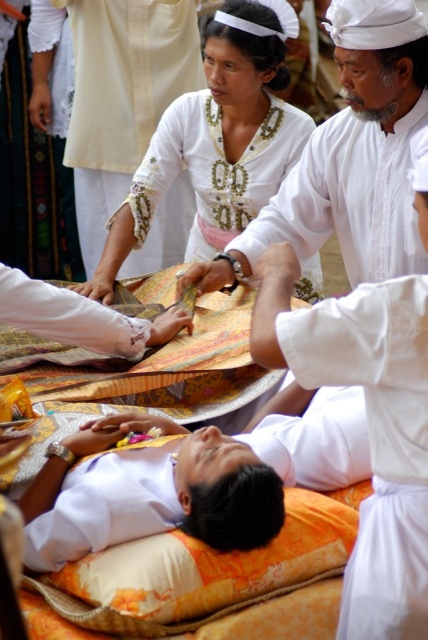
You are an interior designer planning to place a new decorative item in the room. The item must be placed at the point marked by coordinates point (357, 150). What object is currently located at that point?

The point (357, 150) indicates the location of the white matte cloth at upper center.

You are a photographer trying to capture the scene of the person lying on the bed. You notice two points in the image at coordinates point (350, 310) and point (216, 230). Which point is closer to your camera lens?

Point (350, 310) is closer to the camera than point (216, 230).